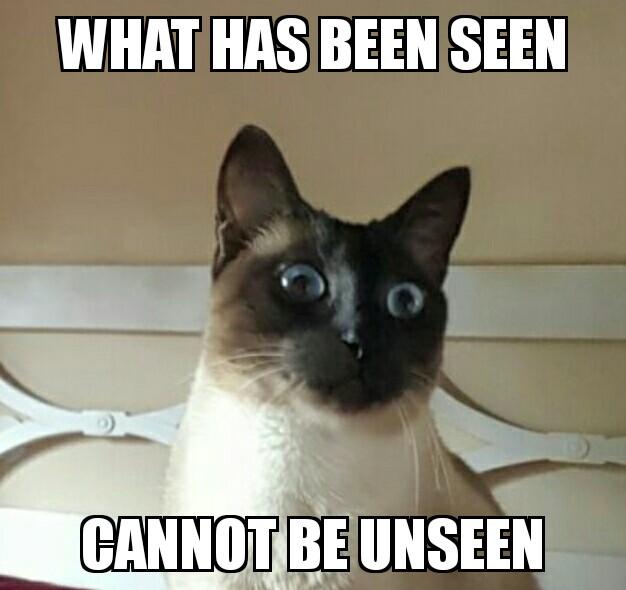
This screenshot has height=590, width=626. I want to click on wall, so click(561, 512).